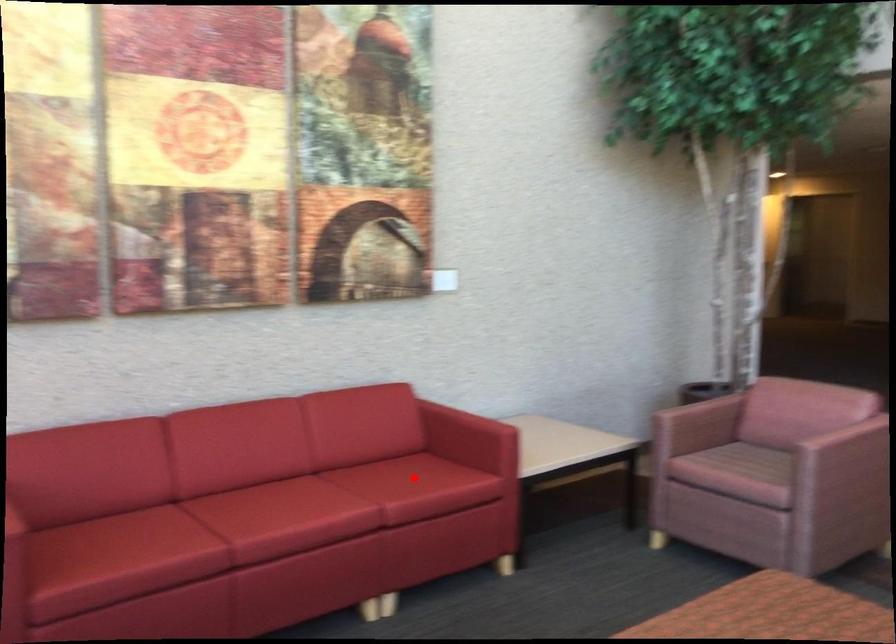
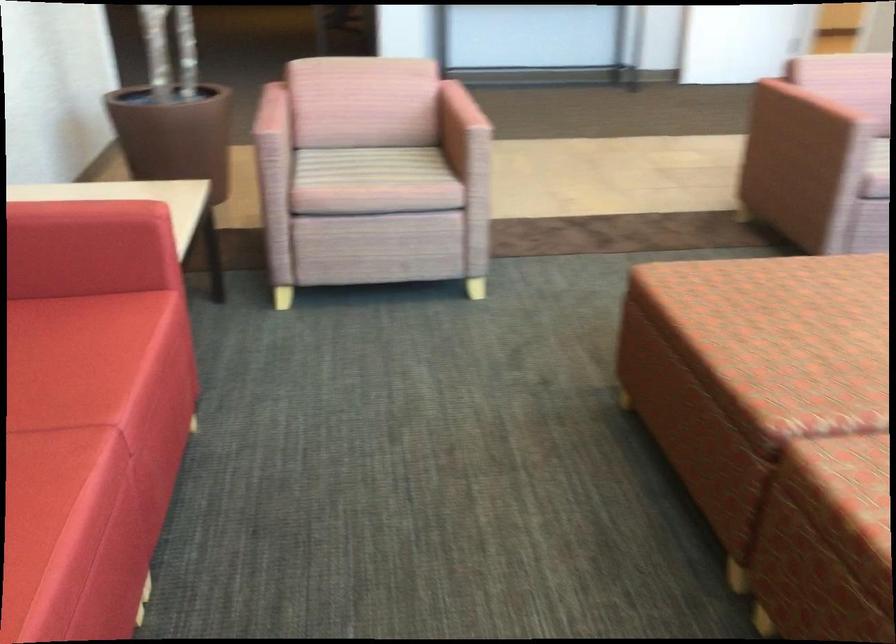
Question: I am providing you with two images of the same scene from different viewpoints. A red point is shown in image1. For the corresponding object point in image2, is it positioned nearer or farther from the camera?

Choices:
 (A) Nearer
 (B) Farther

Answer: (A)